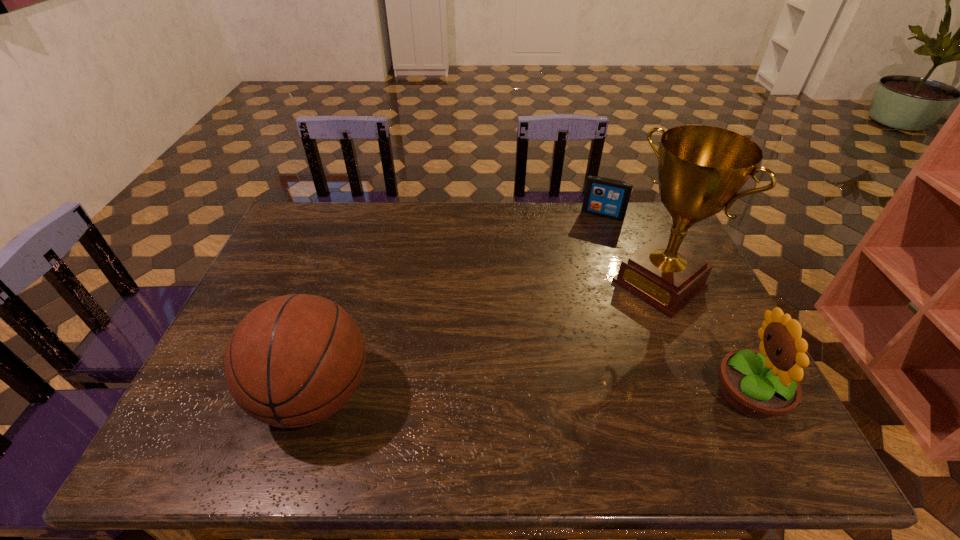
At what (x,y) coordinates should I click in order to perform the action: click on the leftmost object. Please return your answer as a coordinate pair (x, y). The width and height of the screenshot is (960, 540). Looking at the image, I should click on (293, 361).

What are the coordinates of `sunflower` in the screenshot? It's located at (762, 384).

Identify the location of iPod. The width and height of the screenshot is (960, 540). (604, 197).

Image resolution: width=960 pixels, height=540 pixels. In order to click on the farthest object in this screenshot , I will do `click(604, 197)`.

Where is `the second farthest object`? This screenshot has height=540, width=960. the second farthest object is located at coordinates (701, 169).

You are a GUI agent. You are given a task and a screenshot of the screen. Output one action in this format:
    pyautogui.click(x=<x>, y=<y>)
    Task: Click on the tallest object
    
    Given the screenshot: What is the action you would take?
    pyautogui.click(x=701, y=169)

Where is `vacant space located on the side with brand label of the basketball`? The image size is (960, 540). vacant space located on the side with brand label of the basketball is located at coordinates (212, 395).

At what (x,y) coordinates should I click in order to perform the action: click on vacant space located 0.070m on the side with brand label of the basketball. Please return your answer as a coordinate pair (x, y). Looking at the image, I should click on (226, 395).

Locate an element on the screen. The width and height of the screenshot is (960, 540). vacant space located on the side with brand label of the basketball is located at coordinates (208, 395).

Locate an element on the screen. The height and width of the screenshot is (540, 960). vacant region located 0.100m on the face of the sunflower is located at coordinates (670, 395).